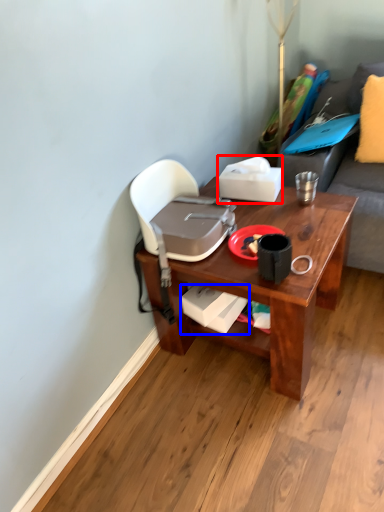
Question: Among these objects, which one is farthest to the camera, box (highlighted by a red box) or box (highlighted by a blue box)?

Choices:
 (A) box
 (B) box

Answer: (A)